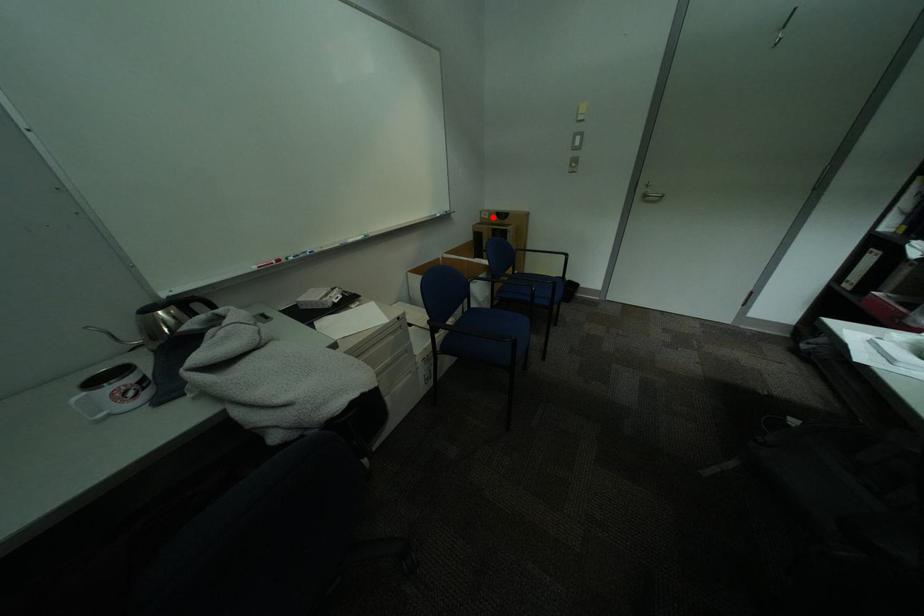
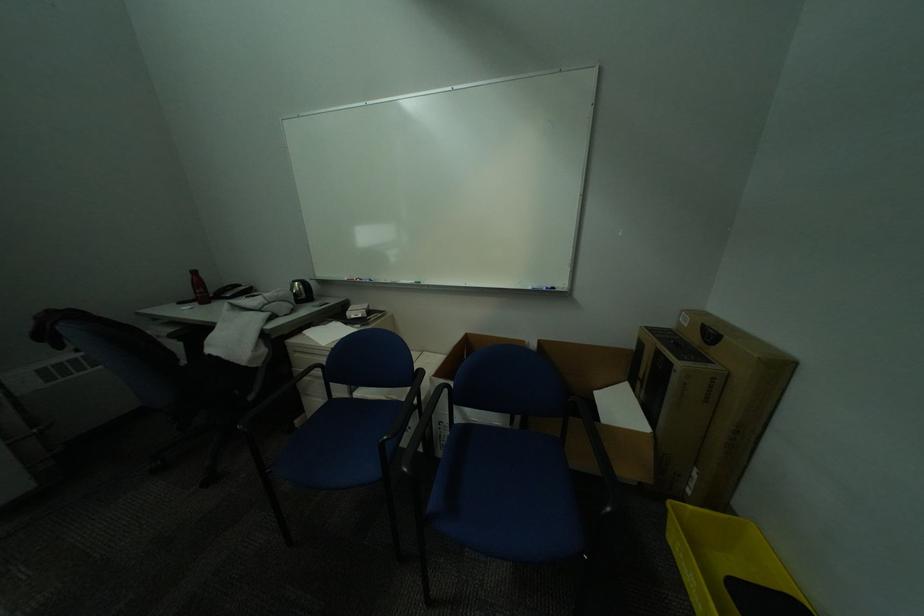
The point at the highlighted location is marked in the first image. Where is the corresponding point in the second image?

(691, 321)